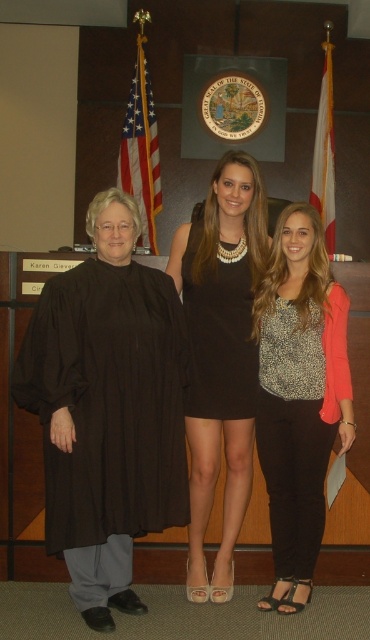
Question: Which object is the closest to the black dress at center?

Choices:
 (A) black matte robe at left
 (B) black satin dress at center

Answer: (B)

Question: Is the position of black matte robe at left more distant than that of black satin dress at center?

Choices:
 (A) no
 (B) yes

Answer: (A)

Question: Does black matte robe at left have a smaller size compared to leopard print blouse at center?

Choices:
 (A) yes
 (B) no

Answer: (B)

Question: From the image, what is the correct spatial relationship of black matte robe at left in relation to black dress at center?

Choices:
 (A) right
 (B) left

Answer: (B)

Question: Which of these objects is positioned farthest from the black satin dress at center?

Choices:
 (A) black matte robe at left
 (B) leopard print blouse at center
 (C) black dress at center

Answer: (A)

Question: Which object appears closest to the camera in this image?

Choices:
 (A) black dress at center
 (B) black matte robe at left
 (C) leopard print blouse at center
 (D) black satin dress at center

Answer: (B)